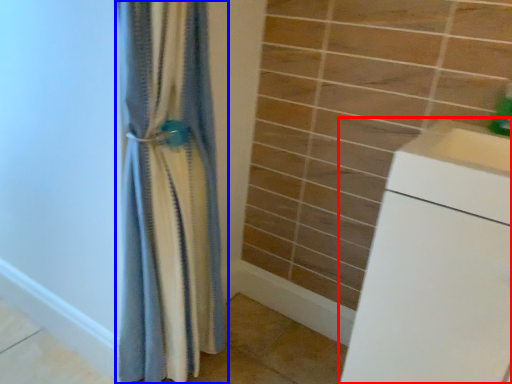
Question: Which object appears closest to the camera in this image, counter (highlighted by a red box) or curtain (highlighted by a blue box)?

Choices:
 (A) counter
 (B) curtain

Answer: (A)